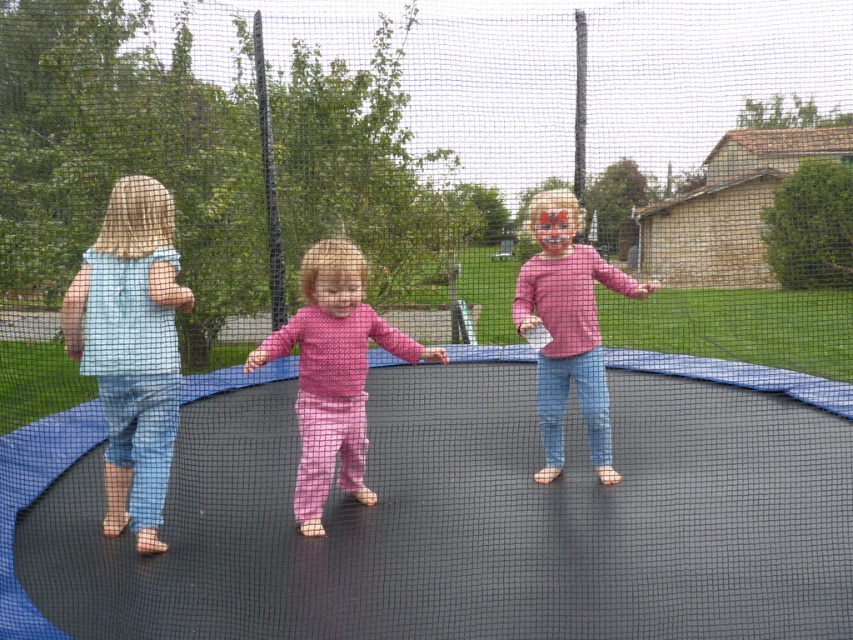
Question: Which of these objects is positioned farthest from the light blue denim jumpsuit at left?

Choices:
 (A) pink matte shirt at center
 (B) pink fabric pants at center

Answer: (A)

Question: Can you confirm if pink fabric pants at center is bigger than pink matte shirt at center?

Choices:
 (A) no
 (B) yes

Answer: (B)

Question: Which object is closer to the camera taking this photo?

Choices:
 (A) light blue denim jumpsuit at left
 (B) pink fabric pants at center
 (C) pink matte shirt at center

Answer: (A)

Question: Is pink fabric pants at center thinner than pink matte shirt at center?

Choices:
 (A) no
 (B) yes

Answer: (A)

Question: Which point is closer to the camera taking this photo?

Choices:
 (A) (560, 426)
 (B) (341, 472)

Answer: (B)

Question: Is light blue denim jumpsuit at left thinner than pink matte shirt at center?

Choices:
 (A) yes
 (B) no

Answer: (A)